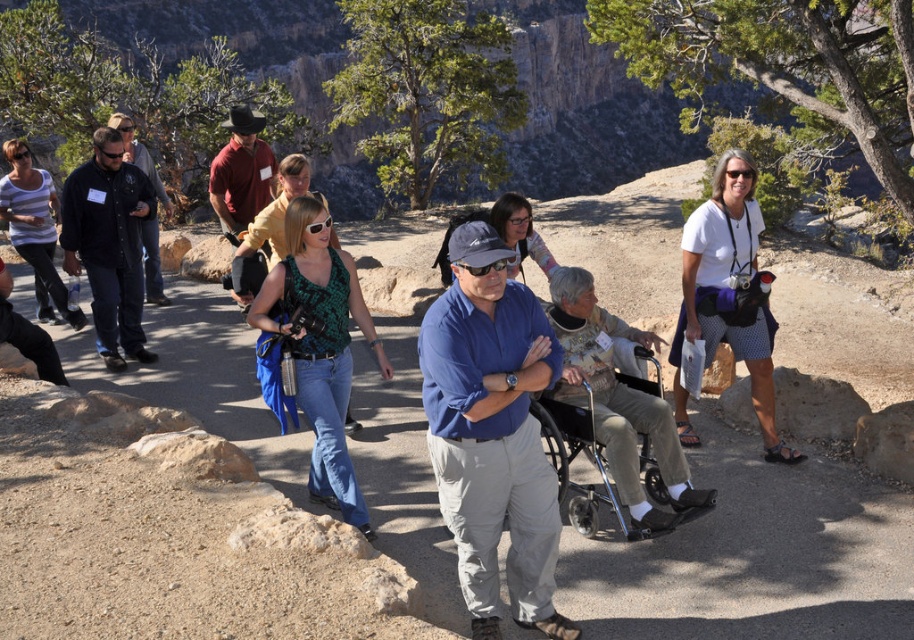
Is blue cotton shirt at center to the right of reddish-brown leather jacket at center from the viewer's perspective?

Indeed, blue cotton shirt at center is positioned on the right side of reddish-brown leather jacket at center.

Does blue cotton shirt at center appear under reddish-brown leather jacket at center?

Correct, blue cotton shirt at center is located below reddish-brown leather jacket at center.

What are the coordinates of `blue cotton shirt at center` in the screenshot? It's located at (492, 433).

Can you confirm if dirt path at center is shorter than black cotton shirt at center?

Correct, dirt path at center is not as tall as black cotton shirt at center.

Who is positioned more to the left, dirt path at center or black cotton shirt at center?

Positioned to the left is black cotton shirt at center.

Does point (837, 516) come behind point (115, 163)?

That is False.

You are a GUI agent. You are given a task and a screenshot of the screen. Output one action in this format:
    pyautogui.click(x=<x>, y=<y>)
    Task: Click on the dirt path at center
    
    Given the screenshot: What is the action you would take?
    pyautogui.click(x=753, y=556)

Is white cotton shirt at center positioned in front of metallic silver wheelchair at center?

No, white cotton shirt at center is behind metallic silver wheelchair at center.

Locate an element on the screen. The width and height of the screenshot is (914, 640). white cotton shirt at center is located at coordinates (728, 296).